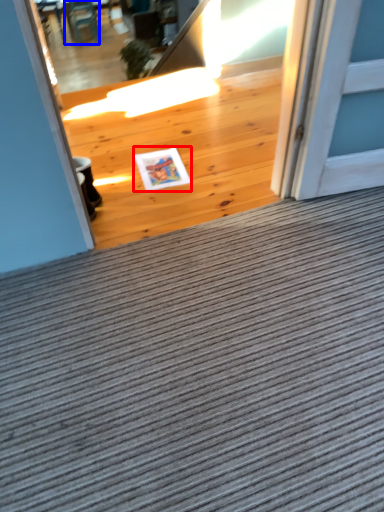
Question: Among these objects, which one is farthest to the camera, postcard (highlighted by a red box) or chair (highlighted by a blue box)?

Choices:
 (A) postcard
 (B) chair

Answer: (B)